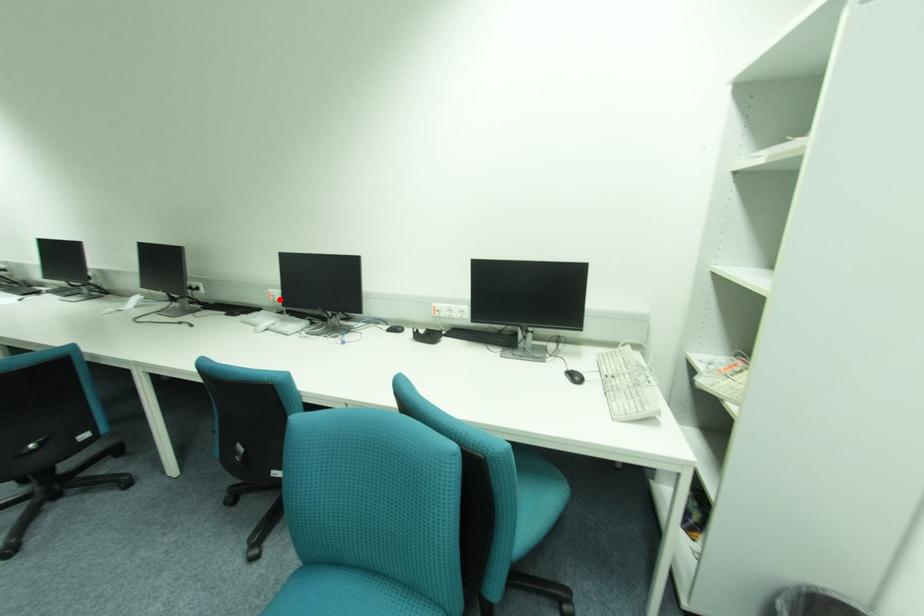
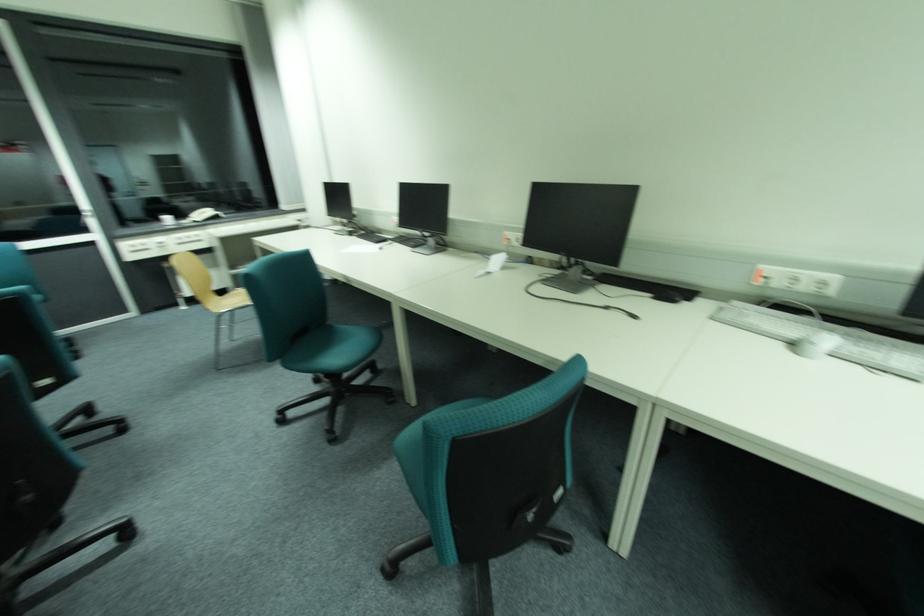
Find the pixel in the second image that matches the highlighted location in the first image.

(772, 283)